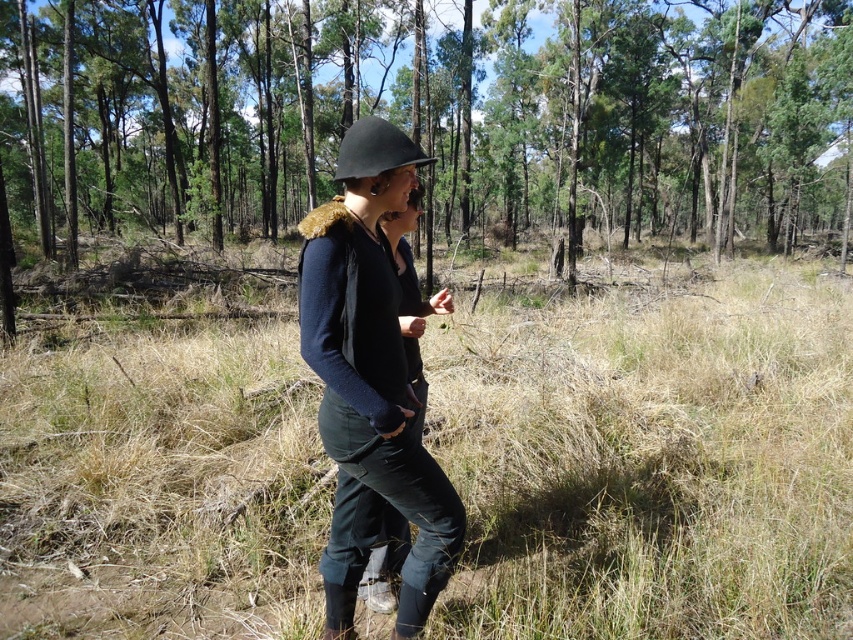
You are a hiker trying to determine the best path through the forest. You notice two types of grass at the center of your path. Which type of grass, the dry grass at center or the green grass at center, would be easier to walk through based on their thickness?

The dry grass at center is thinner than green grass at center, so it would be easier to walk through since thinner grass offers less resistance underfoot.

You are planning to place a small decorative rock on the dry grass at center so it can be seen easily. Based on the scene, will the black matte helmet at center block the view of the rock when viewed from the front?

The dry grass at center is shorter than the black matte helmet at center. Since the helmet is taller, it would block the view of the rock placed on the dry grass at center when viewed from the front.

You are a hiker who wants to place a marker exactly at the center of the dry grass at center. According to the coordinates provided, where should you place the marker?

The dry grass at center should have its marker placed at the coordinates point (651, 458) as specified.